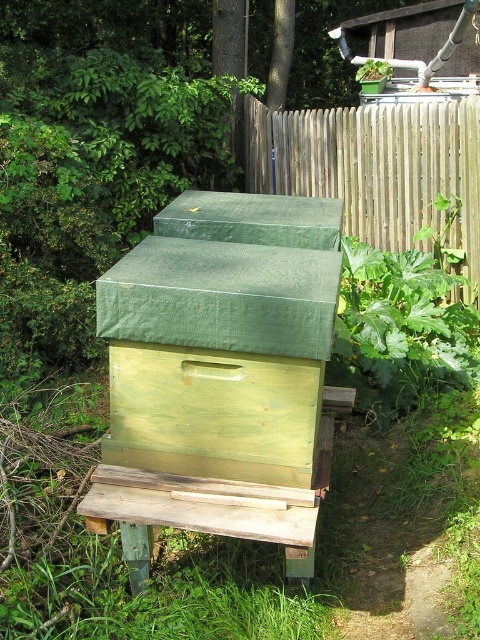
You are a beekeeper inspecting the green painted wood beehive at center and the wooden fence at upper center. Which object is larger in size?

The green painted wood beehive at center is smaller than wooden fence at upper center, so the wooden fence at upper center is larger in size.

You are standing in a garden and want to place a new flower pot between the green painted wood beehive at center and the wooden fence at upper center. Based on their positions, where should you place the flower pot to ensure it is between them?

The green painted wood beehive at center is located below the wooden fence at upper center, so placing the flower pot between them would require positioning it above the beehive and below the fence.